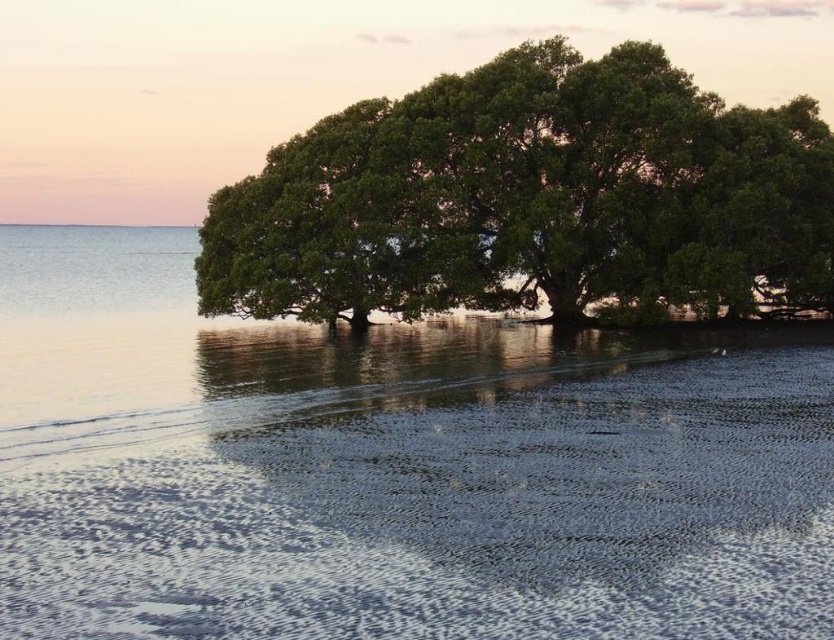
Question: Is smooth sand at lower center above green leafy tree at center?

Choices:
 (A) no
 (B) yes

Answer: (A)

Question: Which of the following is the closest to the observer?

Choices:
 (A) smooth sand at lower center
 (B) green leafy tree at center

Answer: (A)

Question: Observing the image, what is the correct spatial positioning of smooth sand at lower center in reference to green leafy tree at center?

Choices:
 (A) left
 (B) right

Answer: (A)

Question: Among these points, which one is nearest to the camera?

Choices:
 (A) (568, 298)
 (B) (579, 580)

Answer: (B)

Question: Can you confirm if smooth sand at lower center is positioned to the right of green leafy tree at center?

Choices:
 (A) no
 (B) yes

Answer: (A)